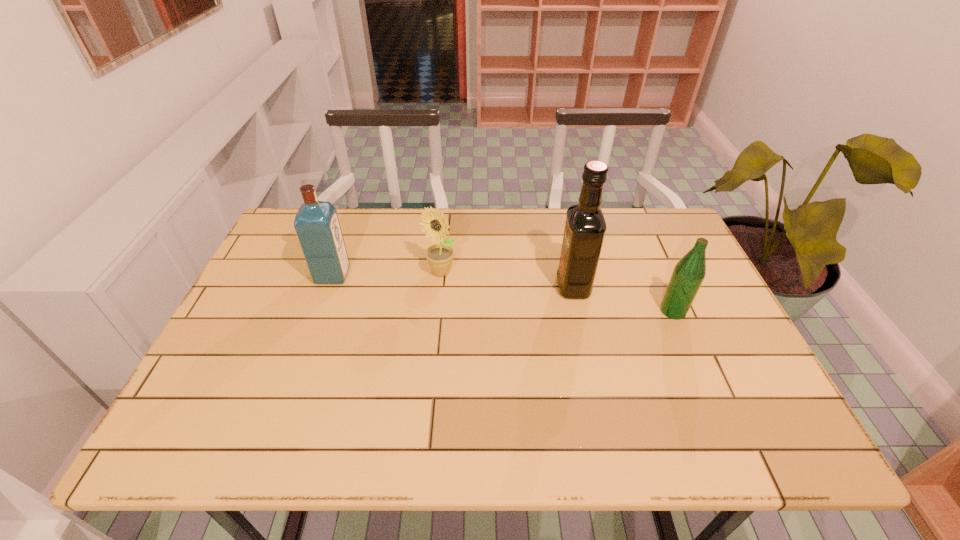
In order to click on empty space that is in between the third object from right to left and the second tallest object in this screenshot , I will do `click(387, 273)`.

Where is `blank region between the rightmost object and the third object from right to left`? blank region between the rightmost object and the third object from right to left is located at coordinates (557, 292).

Where is `vacant space that is in between the taller liquor and the bottle`? The width and height of the screenshot is (960, 540). vacant space that is in between the taller liquor and the bottle is located at coordinates (623, 299).

Locate an element on the screen. The image size is (960, 540). free spot between the leftmost object and the rightmost object is located at coordinates (503, 293).

Locate an element on the screen. The image size is (960, 540). empty space between the tallest object and the second tallest object is located at coordinates (453, 280).

This screenshot has width=960, height=540. Identify the location of free spot between the sunflower and the bottle. (557, 292).

This screenshot has width=960, height=540. I want to click on empty space that is in between the leftmost object and the sunflower, so click(x=387, y=273).

Locate an element on the screen. Image resolution: width=960 pixels, height=540 pixels. free area in between the second object from right to left and the leftmost object is located at coordinates (453, 280).

Image resolution: width=960 pixels, height=540 pixels. Identify the location of empty space between the rightmost object and the sunflower. (557, 292).

The width and height of the screenshot is (960, 540). Identify the location of object identified as the closest to the rightmost object. (585, 227).